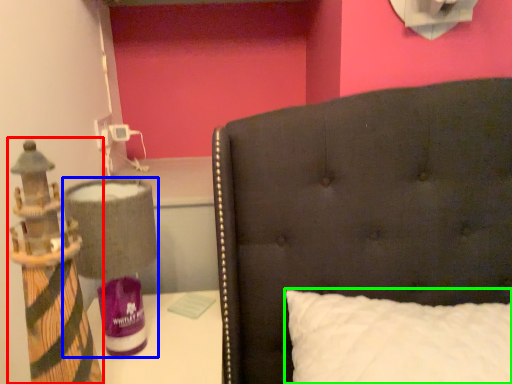
Question: Considering the real-world distances, which object is closest to toy (highlighted by a red box)? table lamp (highlighted by a blue box) or pillow (highlighted by a green box).

Choices:
 (A) table lamp
 (B) pillow

Answer: (A)